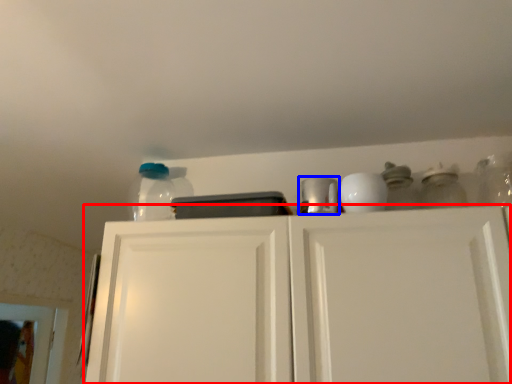
Question: Which point is further to the camera, cabinetry (highlighted by a red box) or appliance (highlighted by a blue box)?

Choices:
 (A) cabinetry
 (B) appliance

Answer: (B)